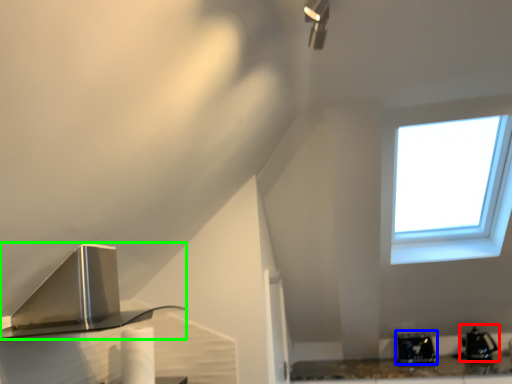
Question: Estimate the real-world distances between objects in this image. Which object is closer to appliance (highlighted by a red box), appliance (highlighted by a blue box) or kitchen appliance (highlighted by a green box)?

Choices:
 (A) appliance
 (B) kitchen appliance

Answer: (A)